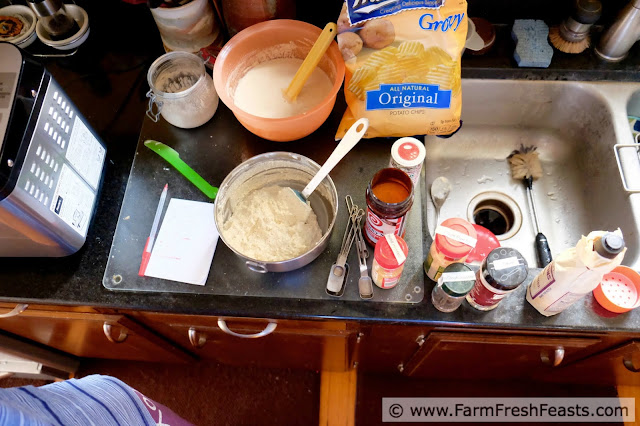
Locate an element on the screen. light orange bowl is located at coordinates (310, 124).